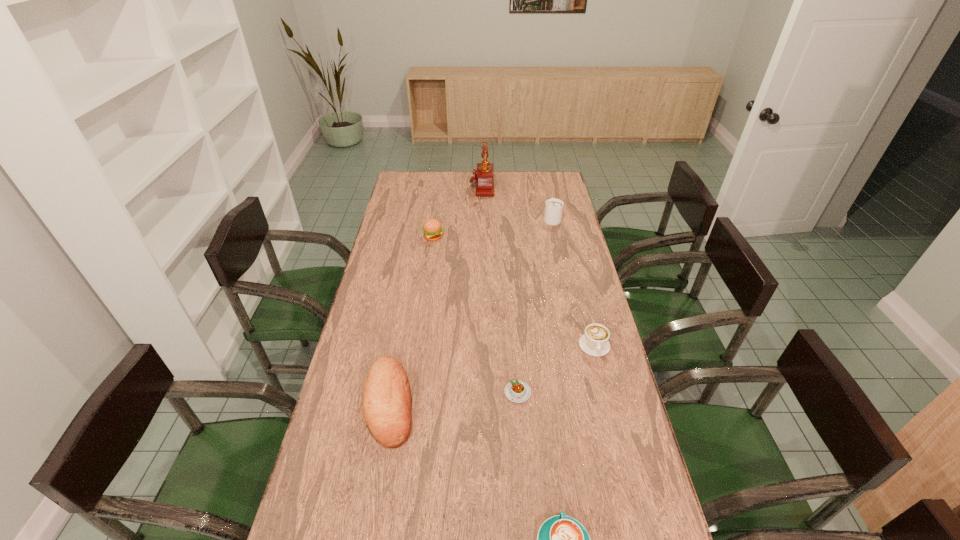
In the image, there is a desktop. Where is `vacant space at the far edge`? The width and height of the screenshot is (960, 540). vacant space at the far edge is located at coordinates (496, 186).

Where is `free point at the left edge`? This screenshot has height=540, width=960. free point at the left edge is located at coordinates (362, 336).

Where is `vacant space at the right edge of the desktop`? vacant space at the right edge of the desktop is located at coordinates (580, 354).

Locate an element on the screen. The height and width of the screenshot is (540, 960). vacant space at the far left corner of the desktop is located at coordinates (415, 193).

The width and height of the screenshot is (960, 540). In the image, there is a desktop. What are the coordinates of `vacant space at the far right corner` in the screenshot? It's located at (549, 181).

Where is `vacant space that is in between the farthest cappuccino and the hamburger`? Image resolution: width=960 pixels, height=540 pixels. vacant space that is in between the farthest cappuccino and the hamburger is located at coordinates (492, 228).

Locate an element on the screen. The width and height of the screenshot is (960, 540). unoccupied position between the bread and the tallest object is located at coordinates (436, 294).

At what (x,y) coordinates should I click in order to perform the action: click on vacant area between the hamburger and the tallest cappuccino. Please return your answer as a coordinate pair (x, y). This screenshot has width=960, height=540. Looking at the image, I should click on (492, 228).

Find the location of a particular element. This screenshot has width=960, height=540. free space between the tallest object and the shortest object is located at coordinates (499, 289).

The image size is (960, 540). What are the coordinates of `free space between the fifth nearest object and the bread` in the screenshot? It's located at (412, 320).